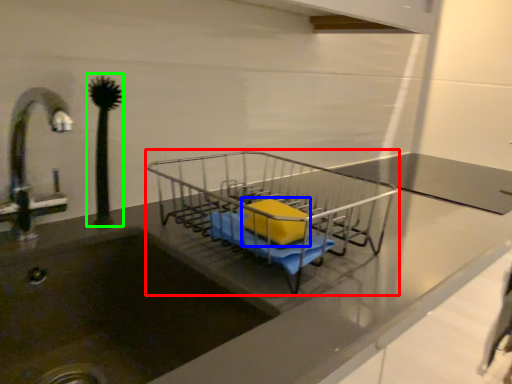
Question: Estimate the real-world distances between objects in this image. Which object is farther from trolley (highlighted by a red box), material (highlighted by a blue box) or plant (highlighted by a green box)?

Choices:
 (A) material
 (B) plant

Answer: (B)